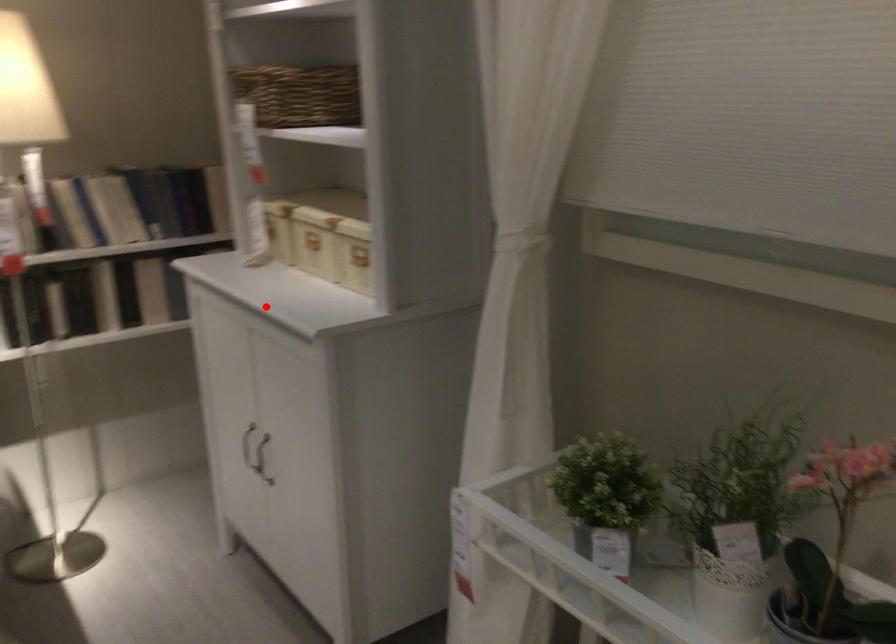
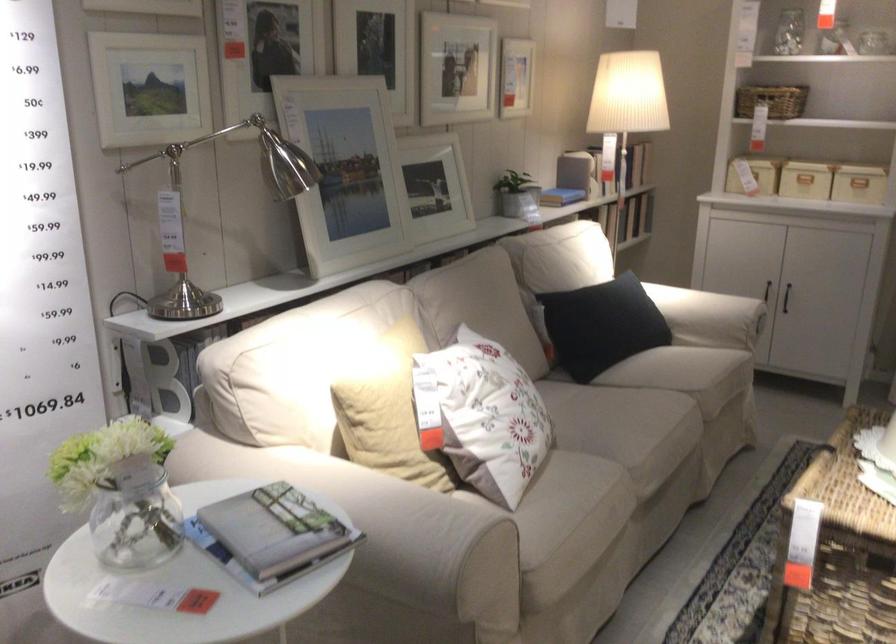
Question: I am providing you with two images of the same scene from different viewpoints. Given a red point in image1, look at the same physical point in image2. Is it:

Choices:
 (A) Closer to the viewpoint
 (B) Farther from the viewpoint

Answer: (B)